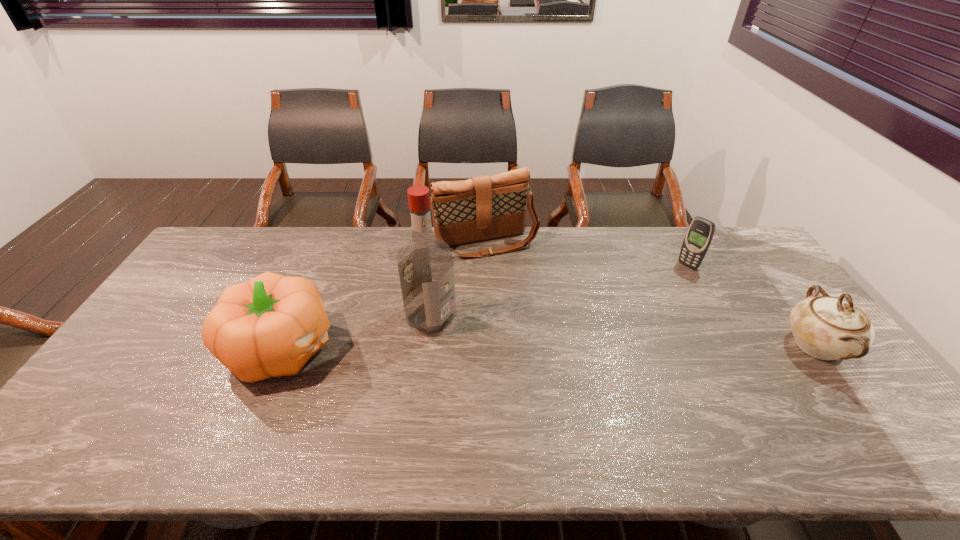
This screenshot has width=960, height=540. In order to click on vacant space located 0.090m on the front-facing side of the shoulder bag in this screenshot , I will do `click(511, 276)`.

I want to click on vacant space located on the front-facing side of the shoulder bag, so click(x=507, y=268).

Where is `blank space located 0.070m on the front-facing side of the shoulder bag`? blank space located 0.070m on the front-facing side of the shoulder bag is located at coordinates (509, 272).

Find the location of a particular element. Image resolution: width=960 pixels, height=540 pixels. vacant area situated 0.220m on the screen of the cellular telephone is located at coordinates (644, 299).

Image resolution: width=960 pixels, height=540 pixels. What are the coordinates of `blank space located on the screen of the cellular telephone` in the screenshot? It's located at (648, 296).

This screenshot has width=960, height=540. I want to click on free spot located 0.370m on the screen of the cellular telephone, so click(x=613, y=322).

Identify the location of shoulder bag positioned at the far edge. (481, 208).

This screenshot has width=960, height=540. I want to click on cellular telephone that is at the far edge, so click(x=700, y=232).

This screenshot has width=960, height=540. I want to click on object located at the near edge, so click(x=270, y=326).

Where is `object that is at the right edge`? object that is at the right edge is located at coordinates (827, 328).